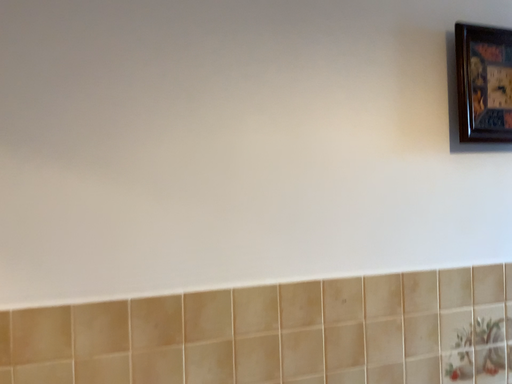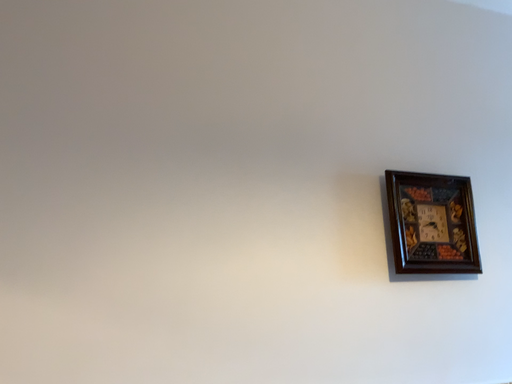
Question: How did the camera likely rotate when shooting the video?

Choices:
 (A) rotated upward
 (B) rotated downward

Answer: (A)